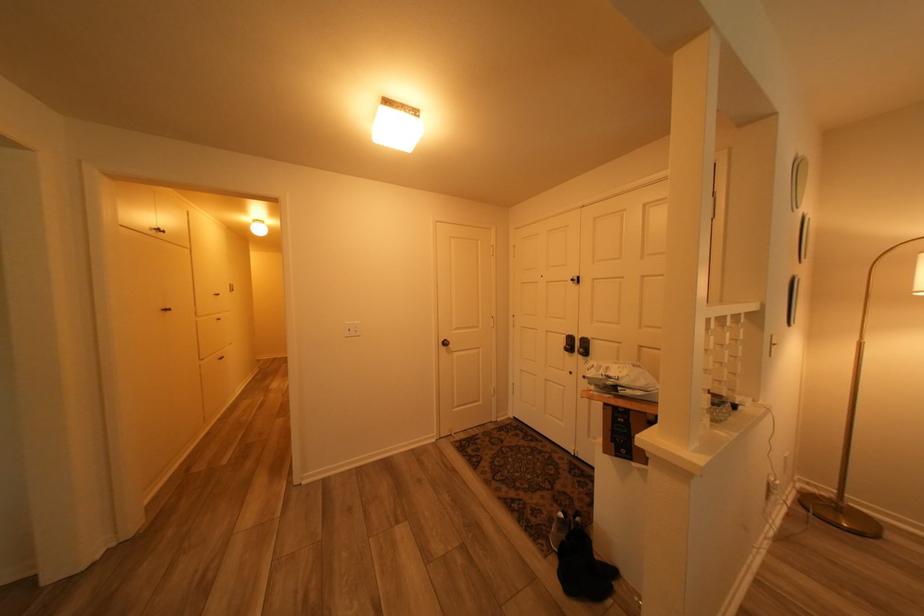
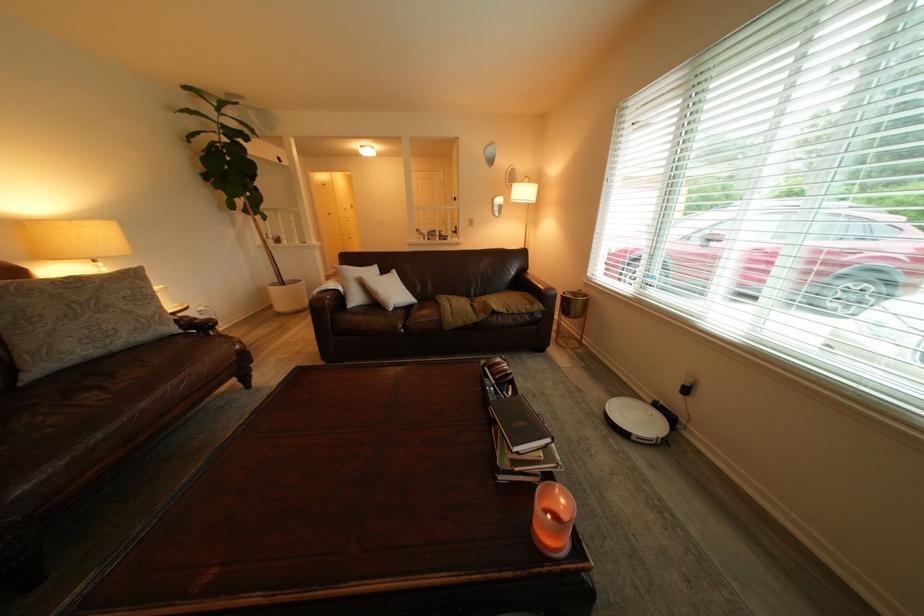
Where in the second image is the point corresponding to pixel 787 346 from the first image?

(484, 223)